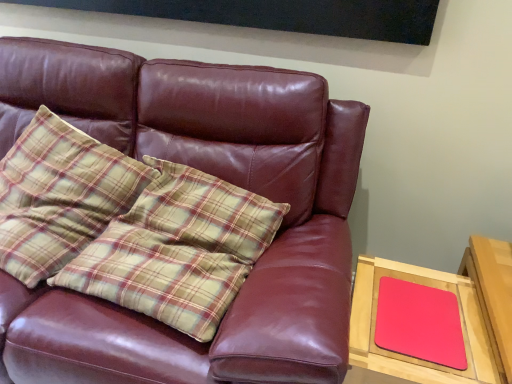
This screenshot has width=512, height=384. I want to click on free space above matte pink mousepad at right (from a real-world perspective), so click(x=418, y=313).